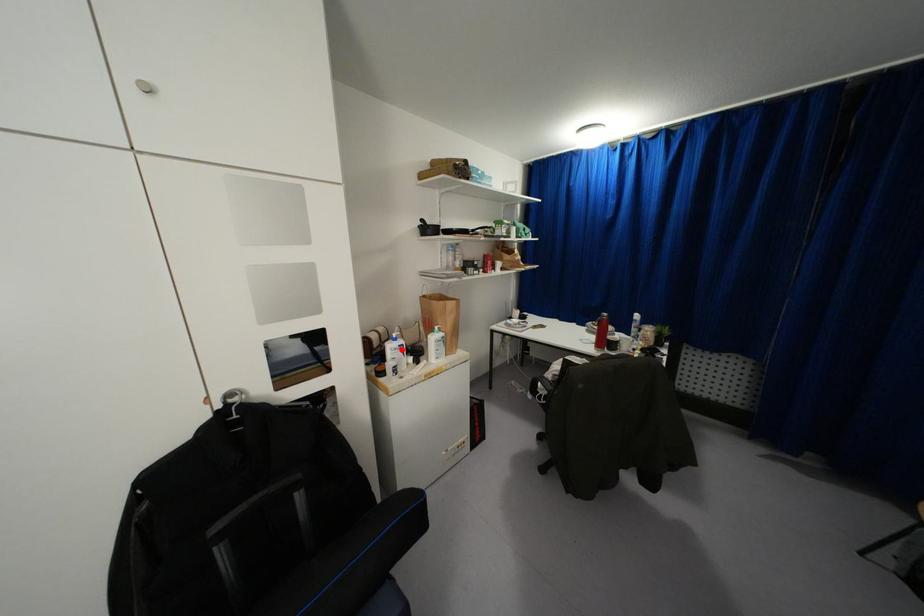
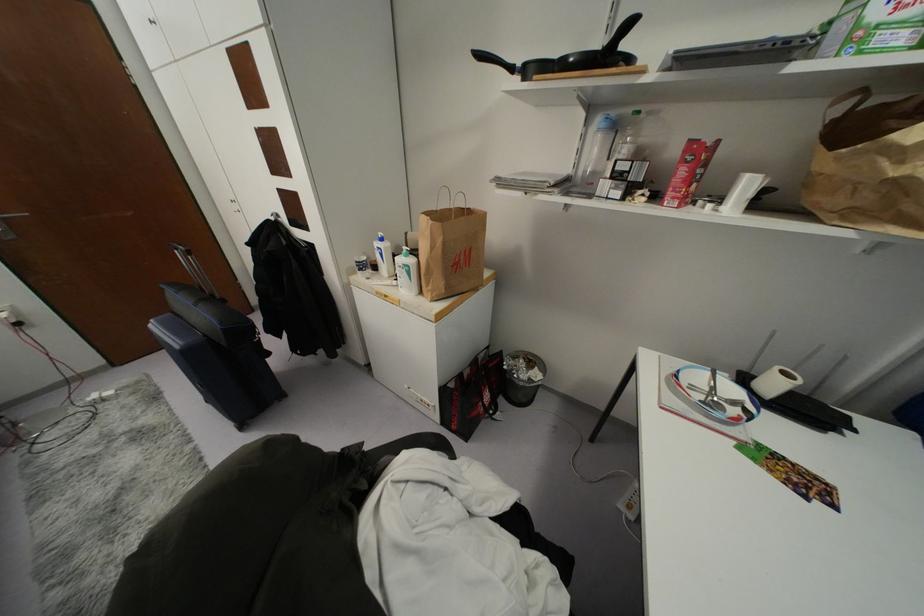
Find the pixel in the second image that matches the highlighted location in the first image.

(381, 254)